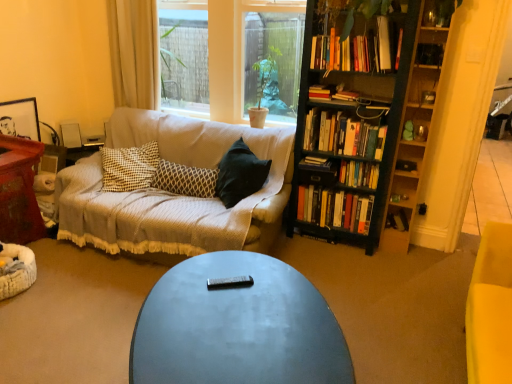
Question: Considering the positions of point (86, 145) and point (261, 72), is point (86, 145) closer or farther from the camera than point (261, 72)?

Choices:
 (A) closer
 (B) farther

Answer: (B)

Question: From a real-world perspective, is wooden side table at left positioned above or below green matte plant at center?

Choices:
 (A) above
 (B) below

Answer: (B)

Question: Based on their relative distances, which object is nearer to the wooden table at left?

Choices:
 (A) hardcover books at center-right, placed as the sixth book when sorted from top to bottom
 (B) hardcover book at upper center, arranged as the 7th book when ordered from the bottom
 (C) wooden side table at left
 (D) patterned fabric pillow at center
 (E) hardcover books at right, the 7th book in the top-to-bottom sequence

Answer: (C)

Question: Which of these objects is positioned farthest from the hardcover book at upper center, which ranks as the third book in top-to-bottom order?

Choices:
 (A) hardcover books at right, marked as the 5th book in a bottom-to-top arrangement
 (B) hardcover books at right, the 2th book when ordered from bottom to top
 (C) clear glass window at center
 (D) green matte plant at center
 (E) hardcover book at upper center, which ranks as the 2th book in top-to-bottom order

Answer: (C)